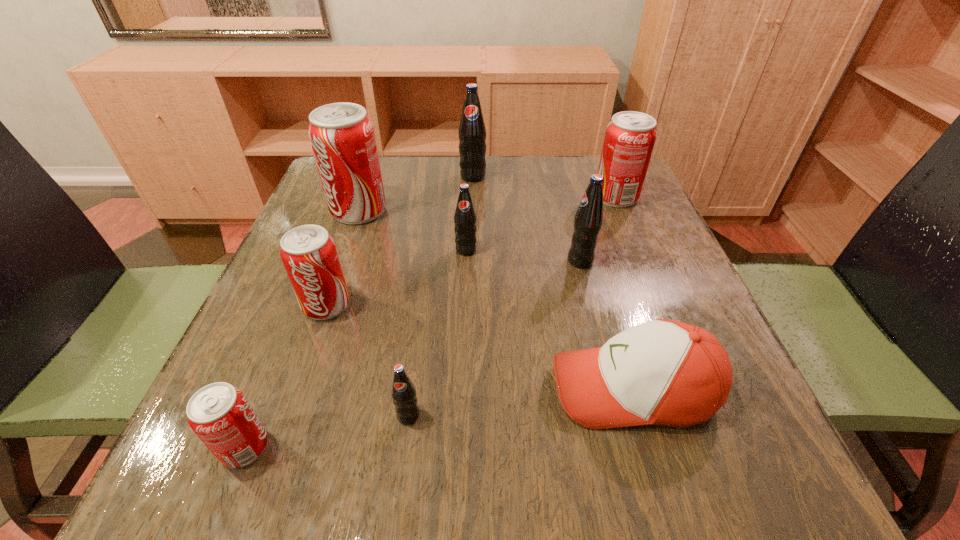
Identify the location of vacant space located on the front label of the third biggest black pop. (460, 427).

The width and height of the screenshot is (960, 540). What are the coordinates of `blank space located on the right of the third nearest soda can` in the screenshot? It's located at (535, 305).

This screenshot has width=960, height=540. Identify the location of vacant area situated on the front-facing side of the baseball cap. (422, 388).

Identify the location of free region located on the front-facing side of the baseball cap. (338, 388).

Identify the location of free space located 0.390m on the front-facing side of the baseball cap. Image resolution: width=960 pixels, height=540 pixels. (300, 388).

I want to click on vacant area situated on the front label of the fourth soda can from left to right, so click(x=399, y=482).

Locate an element on the screen. blank area located 0.200m on the right of the smallest red soda can is located at coordinates (412, 447).

The image size is (960, 540). Find the location of `object located at the near edge`. object located at the near edge is located at coordinates (220, 415).

I want to click on soda can situated at the right edge, so click(630, 137).

This screenshot has width=960, height=540. Find the location of `baseball cap positioned at the right edge`. baseball cap positioned at the right edge is located at coordinates (664, 372).